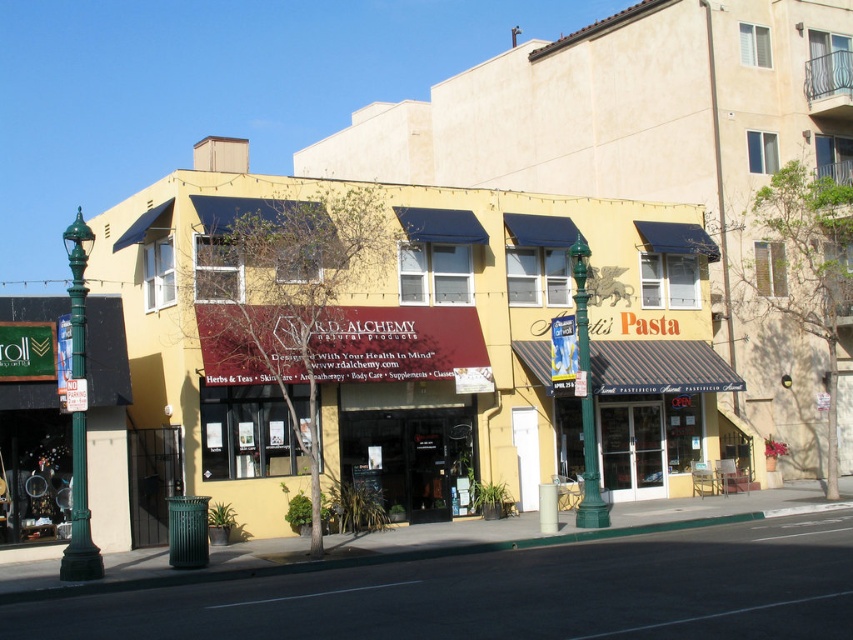
You are a city planner assessing the street layout. You need to install a new security camera on the taller object between the green polished metal streetlight at left and the green metal pole at center. Which object should you choose?

The green polished metal streetlight at left is taller than the green metal pole at center, so you should install the security camera on the green polished metal streetlight at left.

You are a pedestrian standing on the sidewalk in front of the two stores. You need to walk to the green metal pole at center. Which direction should you turn to face the green polished metal streetlight at left?

You should turn to your left to face the green polished metal streetlight at left because it is located to the left of the green metal pole at center.